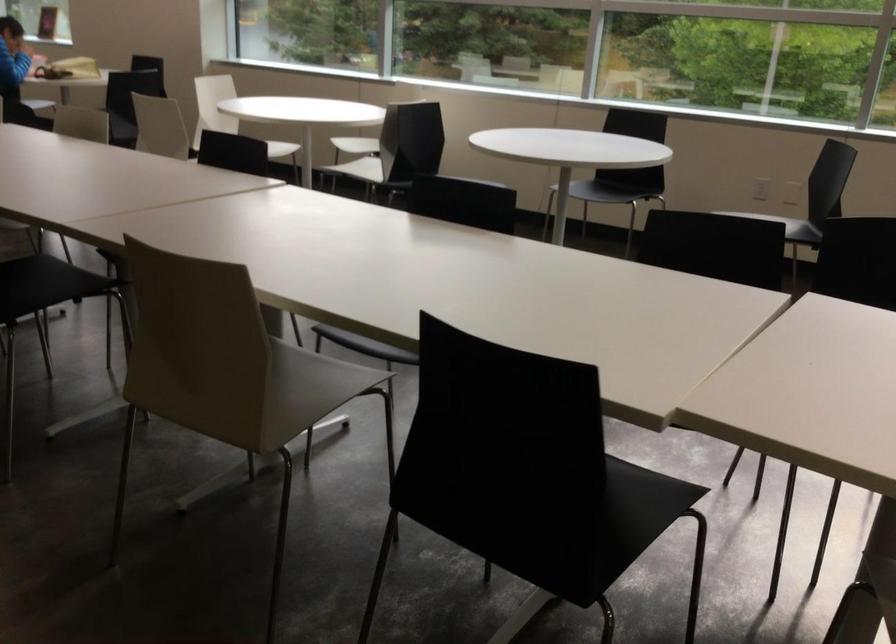
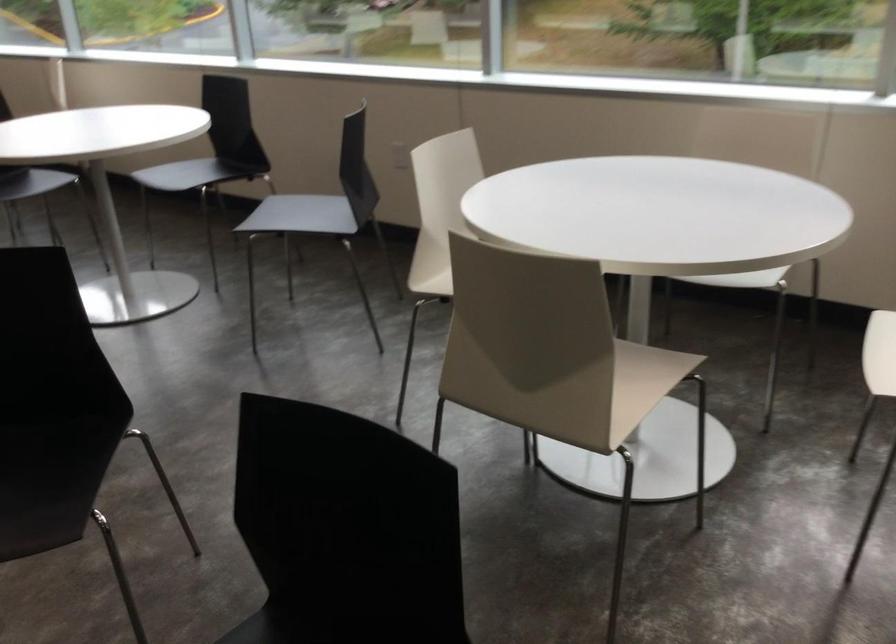
Question: In a continuous first-person perspective shot, in which direction is the camera moving?

Choices:
 (A) Left
 (B) Right
 (C) Forward
 (D) Backward

Answer: (B)